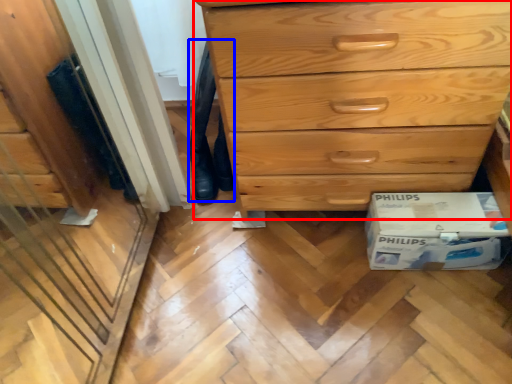
Question: Which of the following is the closest to the observer, chest of drawers (highlighted by a red box) or jeans (highlighted by a blue box)?

Choices:
 (A) chest of drawers
 (B) jeans

Answer: (A)